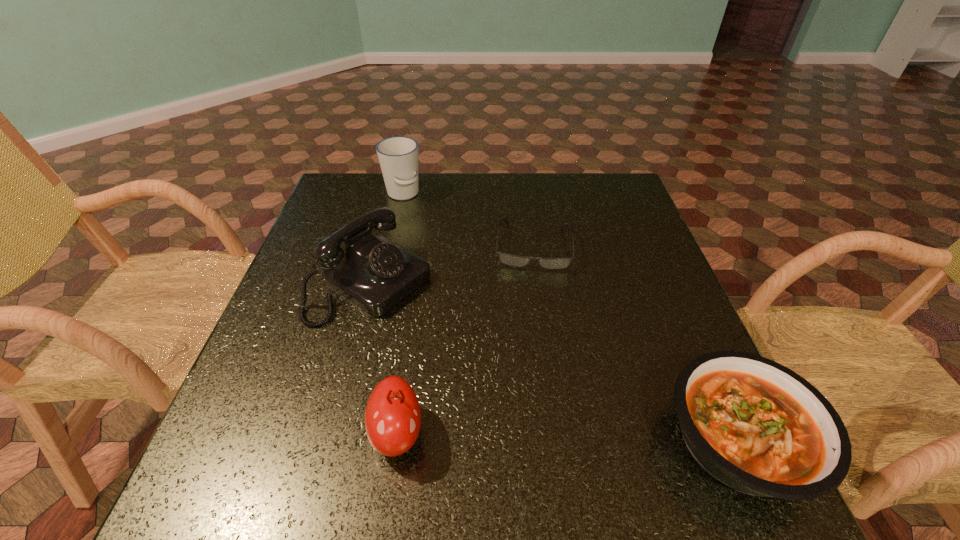
Locate an element on the screen. free space on the desktop that is between the apple and the second shortest object and is positioned with a handle on the side of the cup is located at coordinates [x=520, y=436].

Locate an element on the screen. This screenshot has width=960, height=540. vacant space on the desktop that is between the third shortest object and the rightmost object and is positioned on the front-facing side of the second object from right to left is located at coordinates (525, 436).

This screenshot has height=540, width=960. Find the location of `free space on the desktop that is between the apple and the fourth tallest object and is positioned on the dial of the telephone`. free space on the desktop that is between the apple and the fourth tallest object and is positioned on the dial of the telephone is located at coordinates (611, 438).